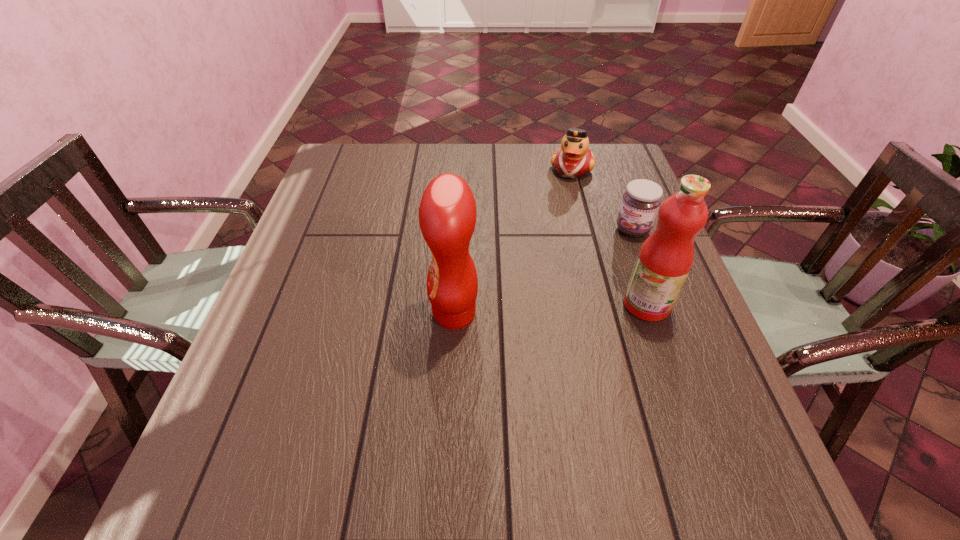
Find the location of a particular element. empty space between the duck and the leftmost object is located at coordinates (513, 241).

This screenshot has height=540, width=960. In order to click on free space between the third nearest object and the farthest object in this screenshot , I will do `click(602, 199)`.

In order to click on empty location between the farthest object and the second farthest object in this screenshot , I will do `click(602, 199)`.

What are the coordinates of `empty space between the leftmost object and the farthest object` in the screenshot? It's located at (513, 241).

In order to click on the second closest object to the second farthest object in this screenshot , I will do `click(573, 159)`.

Choose which object is the nearest neighbor to the duck. Please provide its 2D coordinates. Your answer should be formatted as a tuple, i.e. [(x, y)], where the tuple contains the x and y coordinates of a point satisfying the conditions above.

[(640, 203)]